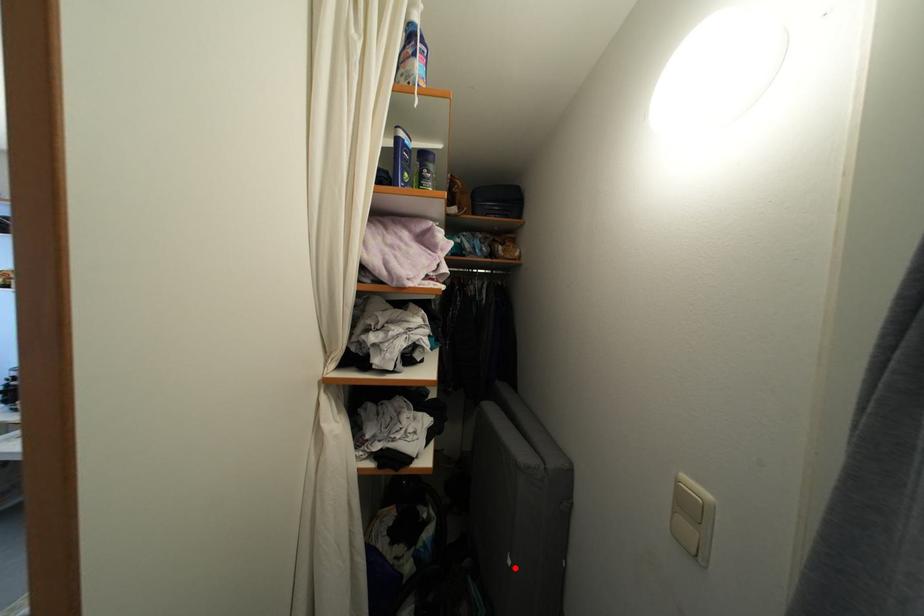
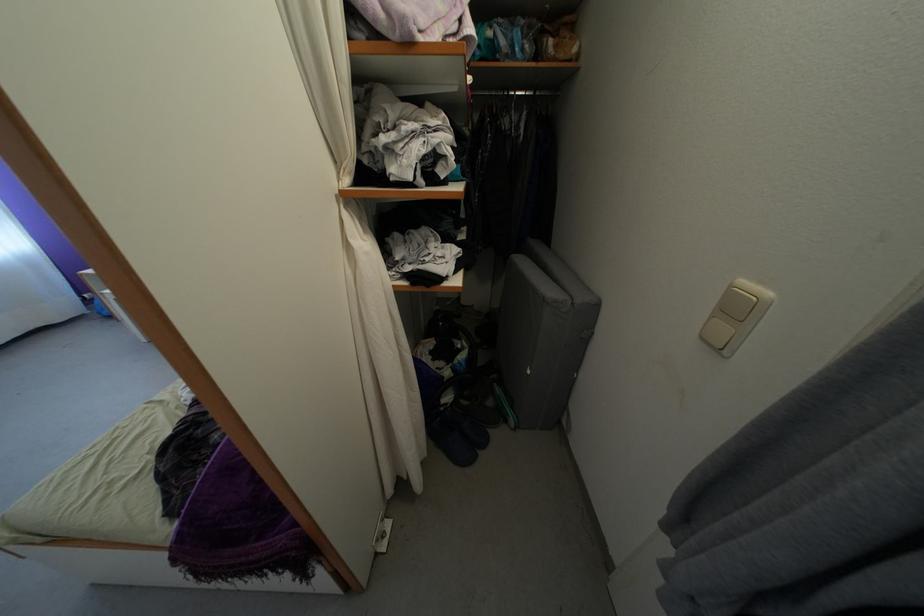
The point at the highlighted location is marked in the first image. Where is the corresponding point in the second image?

(535, 378)